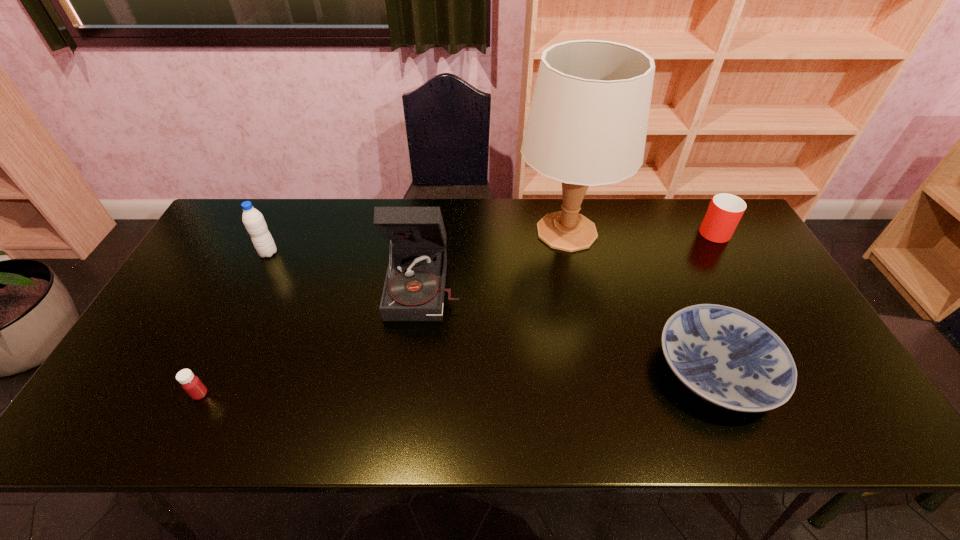
At what (x,y) coordinates should I click in order to perform the action: click on table lamp. Please return your answer as a coordinate pair (x, y). The image size is (960, 540). Looking at the image, I should click on click(x=587, y=125).

Find the location of a particular element. The height and width of the screenshot is (540, 960). phonograph_record is located at coordinates (414, 288).

Identify the location of the fifth shortest object. (414, 288).

You are a GUI agent. You are given a task and a screenshot of the screen. Output one action in this format:
    pyautogui.click(x=<x>, y=<y>)
    Task: Click on the third tallest object
    This screenshot has height=540, width=960.
    Given the screenshot: What is the action you would take?
    pyautogui.click(x=253, y=220)

Where is `cup`? This screenshot has width=960, height=540. cup is located at coordinates (724, 212).

You are a GUI agent. You are given a task and a screenshot of the screen. Output one action in this format:
    pyautogui.click(x=<x>, y=<y>)
    Task: Click on the medicine
    This screenshot has height=540, width=960.
    Given the screenshot: What is the action you would take?
    pyautogui.click(x=192, y=385)

Locate an element on the screen. The height and width of the screenshot is (540, 960). plate is located at coordinates (727, 357).

Image resolution: width=960 pixels, height=540 pixels. I want to click on vacant space positioned 0.360m on the left of the table lamp, so click(404, 232).

This screenshot has width=960, height=540. Identify the location of free space located on the front-facing side of the fifth shortest object. (408, 424).

I want to click on vacant position located 0.170m on the back of the fourth shortest object, so click(288, 213).